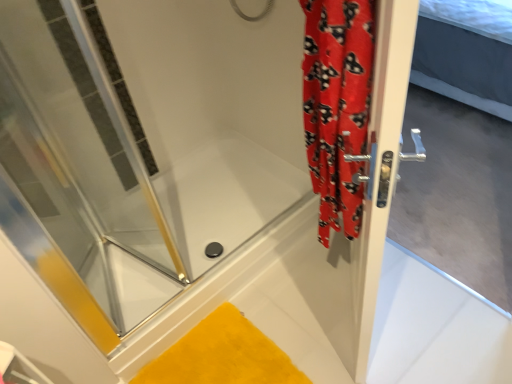
The image size is (512, 384). In order to click on yellow plush bath mat at lower center in this screenshot , I will do `click(222, 355)`.

Between red fabric shower curtain at right and silver metallic door handle at right, which one is positioned behind?

silver metallic door handle at right is more distant.

Is silver metallic door handle at right completely or partially inside red fabric shower curtain at right?

That's incorrect, silver metallic door handle at right is not inside red fabric shower curtain at right.

From a real-world perspective, is red fabric shower curtain at right physically located above or below silver metallic door handle at right?

From a real-world perspective, red fabric shower curtain at right is physically above silver metallic door handle at right.

Is red fabric shower curtain at right to the left of silver metallic door handle at right from the viewer's perspective?

Yes.

From a real-world perspective, is red fabric shower curtain at right below yellow plush bath mat at lower center?

No, from a real-world perspective, red fabric shower curtain at right is not below yellow plush bath mat at lower center.

Is red fabric shower curtain at right wider or thinner than yellow plush bath mat at lower center?

Considering their sizes, red fabric shower curtain at right looks slimmer than yellow plush bath mat at lower center.

Is red fabric shower curtain at right with yellow plush bath mat at lower center?

No.

Measure the distance from red fabric shower curtain at right to yellow plush bath mat at lower center.

75.68 centimeters.

What's the angular difference between transparent glass shower door at left and yellow plush bath mat at lower center's facing directions?

68.8 degrees separate the facing orientations of transparent glass shower door at left and yellow plush bath mat at lower center.

Which is behind, point (21, 122) or point (205, 379)?

The point (205, 379) is behind.

Is transparent glass shower door at left beside yellow plush bath mat at lower center?

transparent glass shower door at left and yellow plush bath mat at lower center are not in contact.

In the scene shown: How distant is transparent glass shower door at left from yellow plush bath mat at lower center?

The distance of transparent glass shower door at left from yellow plush bath mat at lower center is 24.80 inches.

Which of these two, silver metallic door handle at right or yellow plush bath mat at lower center, is smaller?

yellow plush bath mat at lower center is smaller.

Which object is positioned more to the right, silver metallic door handle at right or yellow plush bath mat at lower center?

silver metallic door handle at right.

Is yellow plush bath mat at lower center inside silver metallic door handle at right?

Actually, yellow plush bath mat at lower center is outside silver metallic door handle at right.

Who is taller, transparent glass shower door at left or silver metallic door handle at right?

silver metallic door handle at right is taller.

Is transparent glass shower door at left oriented away from silver metallic door handle at right?

That's not correct — transparent glass shower door at left is not looking away from silver metallic door handle at right.

From a real-world perspective, is transparent glass shower door at left on silver metallic door handle at right?

Indeed, from a real-world perspective, transparent glass shower door at left stands above silver metallic door handle at right.

Is transparent glass shower door at left beside silver metallic door handle at right?

No, transparent glass shower door at left is not in contact with silver metallic door handle at right.

Considering the relative positions of yellow plush bath mat at lower center and silver metallic door handle at right in the image provided, is yellow plush bath mat at lower center to the left or to the right of silver metallic door handle at right?

Clearly, yellow plush bath mat at lower center is on the left of silver metallic door handle at right in the image.

Looking at this image, what's the angular difference between yellow plush bath mat at lower center and silver metallic door handle at right's facing directions?

176 degrees separate the facing orientations of yellow plush bath mat at lower center and silver metallic door handle at right.

Is the surface of yellow plush bath mat at lower center in direct contact with silver metallic door handle at right?

No, yellow plush bath mat at lower center is not next to silver metallic door handle at right.

Considering the sizes of yellow plush bath mat at lower center and transparent glass shower door at left in the image, is yellow plush bath mat at lower center wider or thinner than transparent glass shower door at left?

Considering their sizes, yellow plush bath mat at lower center looks slimmer than transparent glass shower door at left.

Which object is closer to the camera, yellow plush bath mat at lower center or transparent glass shower door at left?

transparent glass shower door at left is closer to the camera.

Between yellow plush bath mat at lower center and transparent glass shower door at left, which one has more height?

transparent glass shower door at left.

Would you say yellow plush bath mat at lower center is inside or outside transparent glass shower door at left?

yellow plush bath mat at lower center cannot be found inside transparent glass shower door at left.

You are a GUI agent. You are given a task and a screenshot of the screen. Output one action in this format:
    pyautogui.click(x=<x>, y=<y>)
    Task: Click on the screen door behind the red fabric shower curtain at right
    The image size is (512, 384).
    Given the screenshot: What is the action you would take?
    pyautogui.click(x=416, y=262)

This screenshot has width=512, height=384. I want to click on shower curtain located in front of the yellow plush bath mat at lower center, so click(337, 105).

Based on their spatial positions, is yellow plush bath mat at lower center or red fabric shower curtain at right further from transparent glass shower door at left?

red fabric shower curtain at right.

Which object lies further to the anchor point red fabric shower curtain at right, yellow plush bath mat at lower center or transparent glass shower door at left?

Based on the image, transparent glass shower door at left appears to be further to red fabric shower curtain at right.

When comparing their distances from red fabric shower curtain at right, does silver metallic door handle at right or transparent glass shower door at left seem closer?

silver metallic door handle at right.

Based on their spatial positions, is silver metallic door handle at right or red fabric shower curtain at right closer to transparent glass shower door at left?

red fabric shower curtain at right.

In the scene shown: Estimate the real-world distances between objects in this image. Which object is closer to yellow plush bath mat at lower center, red fabric shower curtain at right or transparent glass shower door at left?

transparent glass shower door at left lies closer to yellow plush bath mat at lower center than the other object.

Considering their positions, is transparent glass shower door at left positioned closer to silver metallic door handle at right than red fabric shower curtain at right?

red fabric shower curtain at right is positioned closer to the anchor silver metallic door handle at right.

Looking at the image, which one is located further to silver metallic door handle at right, yellow plush bath mat at lower center or transparent glass shower door at left?

transparent glass shower door at left is further to silver metallic door handle at right.

When comparing their distances from transparent glass shower door at left, does red fabric shower curtain at right or silver metallic door handle at right seem closer?

red fabric shower curtain at right lies closer to transparent glass shower door at left than the other object.

At what (x,y) coordinates should I click in order to perform the action: click on screen door between red fabric shower curtain at right and yellow plush bath mat at lower center from top to bottom. Please return your answer as a coordinate pair (x, y). This screenshot has height=384, width=512. Looking at the image, I should click on (416, 262).

At what (x,y) coordinates should I click in order to perform the action: click on bath mat between transparent glass shower door at left and silver metallic door handle at right in the horizontal direction. Please return your answer as a coordinate pair (x, y). Looking at the image, I should click on (222, 355).

Where is `shower curtain between transparent glass shower door at left and silver metallic door handle at right in the horizontal direction`? shower curtain between transparent glass shower door at left and silver metallic door handle at right in the horizontal direction is located at coordinates (337, 105).

This screenshot has width=512, height=384. What are the coordinates of `shower curtain between transparent glass shower door at left and yellow plush bath mat at lower center in the up-down direction` in the screenshot? It's located at (337, 105).